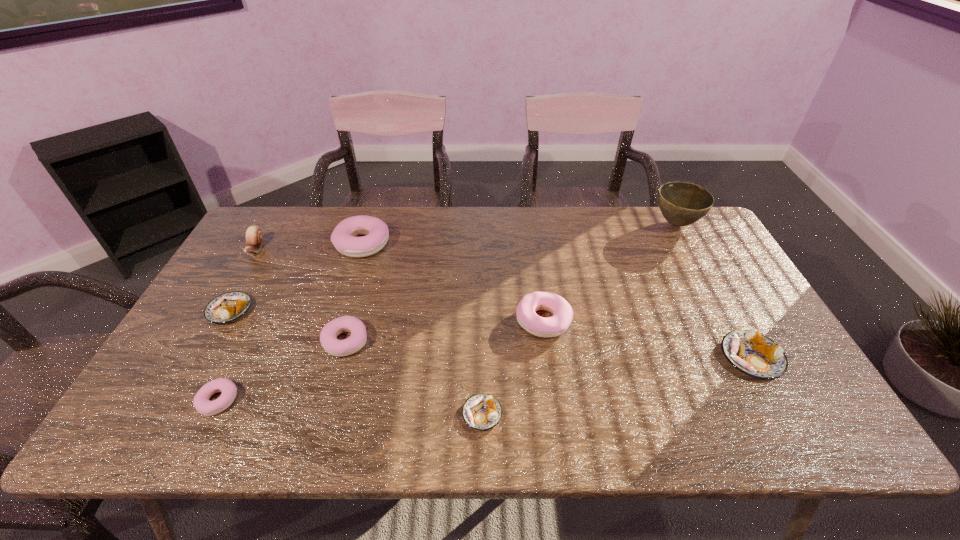
In order to click on pastry that is at the right edge in this screenshot , I will do `click(754, 354)`.

This screenshot has height=540, width=960. I want to click on object present at the far left corner, so click(x=254, y=238).

Where is `object at the near left corner`? Image resolution: width=960 pixels, height=540 pixels. object at the near left corner is located at coordinates (202, 404).

The width and height of the screenshot is (960, 540). I want to click on object at the far right corner, so click(x=681, y=203).

The image size is (960, 540). What are the coordinates of `blank space at the far edge of the desktop` in the screenshot? It's located at (548, 226).

You are a GUI agent. You are given a task and a screenshot of the screen. Output one action in this format:
    pyautogui.click(x=<x>, y=<y>)
    Task: Click on the vacant space at the near edge
    Image resolution: width=960 pixels, height=540 pixels.
    Given the screenshot: What is the action you would take?
    click(756, 434)

Locate an element on the screen. This screenshot has height=540, width=960. vacant space at the left edge of the desktop is located at coordinates (284, 261).

The height and width of the screenshot is (540, 960). I want to click on vacant space at the right edge of the desktop, so click(x=689, y=265).

Find the location of a particular element. Image resolution: width=960 pixels, height=540 pixels. vacant space at the far left corner of the desktop is located at coordinates 269,214.

I want to click on free space between the farthest pastry and the seventh object from left to right, so click(453, 282).